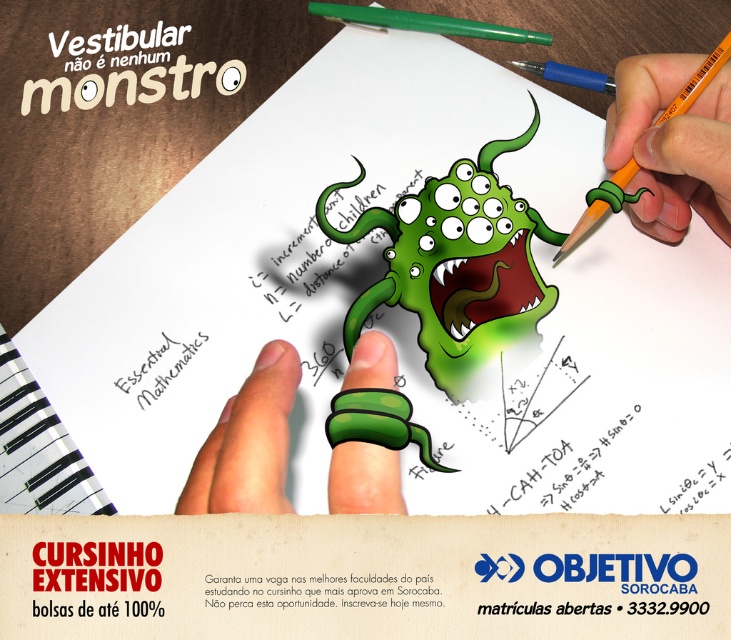
You are a student organizing your study materials. You have a green rubber band at center and an orange pencil at upper right. Which object can you use to secure your loose papers?

The green rubber band at center can be used to secure loose papers, as it is designed for holding items together, unlike the orange pencil at upper right which is for writing.

You are a student organizing your study materials. You have a green rubber band at center and an orange pencil at upper right. Which object is closer to the left side of the image?

The green rubber band at center is closer to the left side of the image than the orange pencil at upper right.

You have a green rubber band at center and an orange pencil at upper right. Which object is wider?

The green rubber band at center is wider than the orange pencil at upper right.